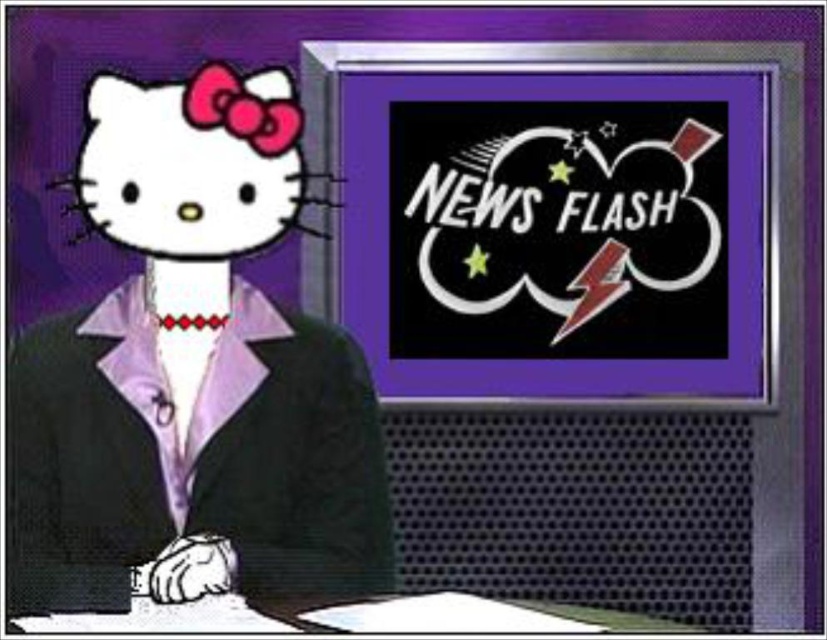
You are designing a poster for a retro TV show and need to place the black glossy screen at upper right and the white matte hello kitty head at upper left. Based on their sizes, which object should be placed closer to the center of the poster to maintain visual balance?

The black glossy screen at upper right is larger in size than the white matte hello kitty head at upper left, so to maintain visual balance, the smaller white matte hello kitty head at upper left should be placed closer to the center of the poster while the larger black glossy screen at upper right can be positioned slightly away from the center.

Based on the photo, you are an interior designer planning to place a new sofa in the living room. The sofa must be placed such that it faces the television set on the right side of the room. Given that the black matte business suit at center is already occupying space at point 0.714, 0.232, will placing the sofa directly in front of the television set interfere with the existing suit?

The black matte business suit at center is located at point (190,456). Placing the sofa directly in front of the television set on the right side would not interfere with the suit since their positions are distinct and separated in the room.